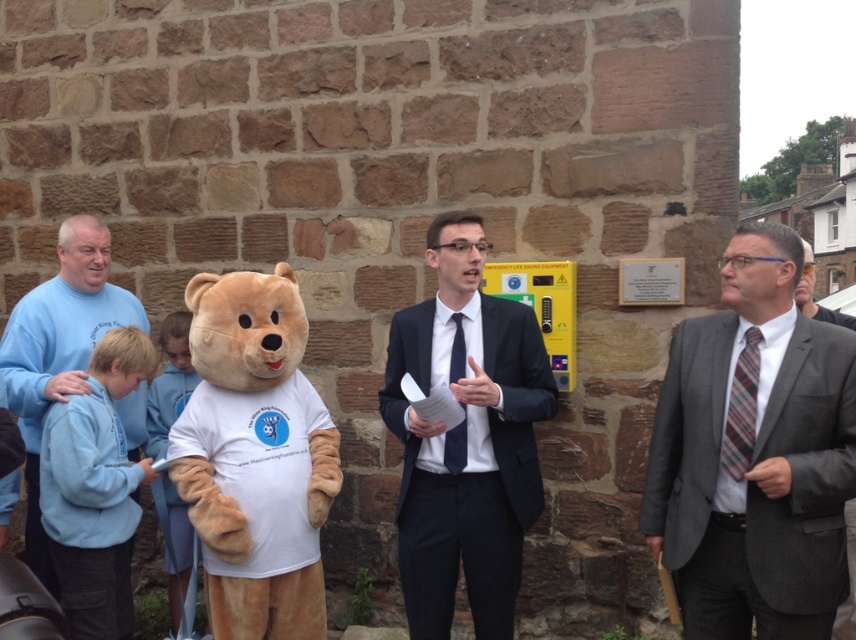
Question: From the image, what is the correct spatial relationship of plaid fabric tie at right in relation to dark blue silk tie at center?

Choices:
 (A) left
 (B) right

Answer: (B)

Question: Can you confirm if dark blue suit at center is bigger than blue cotton shirt at left?

Choices:
 (A) yes
 (B) no

Answer: (B)

Question: Among these objects, which one is nearest to the camera?

Choices:
 (A) dark blue silk tie at center
 (B) plaid fabric tie at right
 (C) blue cotton shirt at left
 (D) gray wool suit at right

Answer: (D)

Question: Which of the following is the closest to the observer?

Choices:
 (A) pyautogui.click(x=449, y=470)
 (B) pyautogui.click(x=277, y=492)

Answer: (B)

Question: Which object is farther from the camera taking this photo?

Choices:
 (A) dark blue suit at center
 (B) blue cotton shirt at left

Answer: (B)

Question: Is fluffy beige teddy bear at center behind dark blue silk tie at center?

Choices:
 (A) yes
 (B) no

Answer: (B)